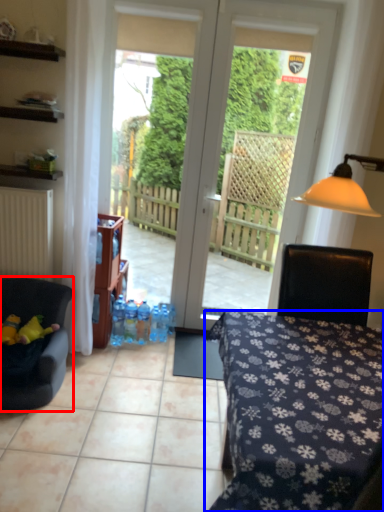
Question: Which of the following is the farthest to the observer, chair (highlighted by a red box) or desk (highlighted by a blue box)?

Choices:
 (A) chair
 (B) desk

Answer: (A)